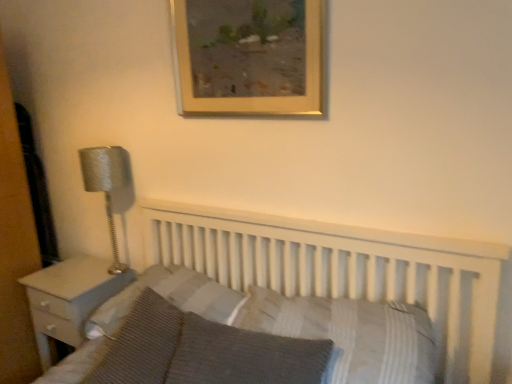
Question: Could you tell me if white wood nightstand at left is facing silver textured lamp at left?

Choices:
 (A) no
 (B) yes

Answer: (A)

Question: Would you say white wood nightstand at left is outside silver textured lamp at left?

Choices:
 (A) no
 (B) yes

Answer: (B)

Question: From a real-world perspective, is white wood nightstand at left over silver textured lamp at left?

Choices:
 (A) no
 (B) yes

Answer: (A)

Question: Can you confirm if white wood nightstand at left is wider than silver textured lamp at left?

Choices:
 (A) no
 (B) yes

Answer: (B)

Question: Does white wood nightstand at left have a greater height compared to silver textured lamp at left?

Choices:
 (A) no
 (B) yes

Answer: (A)

Question: From the image's perspective, is white wood bed at center located above or below gold wooden picture frame at upper center?

Choices:
 (A) above
 (B) below

Answer: (B)

Question: Is white wood bed at center wider or thinner than gold wooden picture frame at upper center?

Choices:
 (A) thin
 (B) wide

Answer: (B)

Question: Which is correct: white wood bed at center is inside gold wooden picture frame at upper center, or outside of it?

Choices:
 (A) inside
 (B) outside

Answer: (B)

Question: Relative to gold wooden picture frame at upper center, is white wood bed at center in front or behind?

Choices:
 (A) behind
 (B) front

Answer: (B)

Question: From the image's perspective, is white textured pillow at center, which appears as the 1th pillow when viewed from the right, positioned above or below striped fabric pillow at center, the second pillow from the left?

Choices:
 (A) below
 (B) above

Answer: (A)

Question: Does point (423, 337) appear closer or farther from the camera than point (216, 319)?

Choices:
 (A) farther
 (B) closer

Answer: (B)

Question: Which is correct: white textured pillow at center, positioned as the 4th pillow in left-to-right order, is inside striped fabric pillow at center, the second pillow from the left, or outside of it?

Choices:
 (A) outside
 (B) inside

Answer: (A)

Question: Considering the positions of white textured pillow at center, positioned as the 4th pillow in left-to-right order, and striped fabric pillow at center, the second pillow from the left, in the image, is white textured pillow at center, positioned as the 4th pillow in left-to-right order, taller or shorter than striped fabric pillow at center, the second pillow from the left,?

Choices:
 (A) tall
 (B) short

Answer: (B)

Question: Considering the positions of knitted fabric pillow at lower left, marked as the fourth pillow in a right-to-left arrangement, and striped fabric pillow at center, the second pillow from the left, in the image, is knitted fabric pillow at lower left, marked as the fourth pillow in a right-to-left arrangement, wider or thinner than striped fabric pillow at center, the second pillow from the left,?

Choices:
 (A) thin
 (B) wide

Answer: (B)

Question: Does point (144, 380) appear closer or farther from the camera than point (105, 306)?

Choices:
 (A) farther
 (B) closer

Answer: (B)